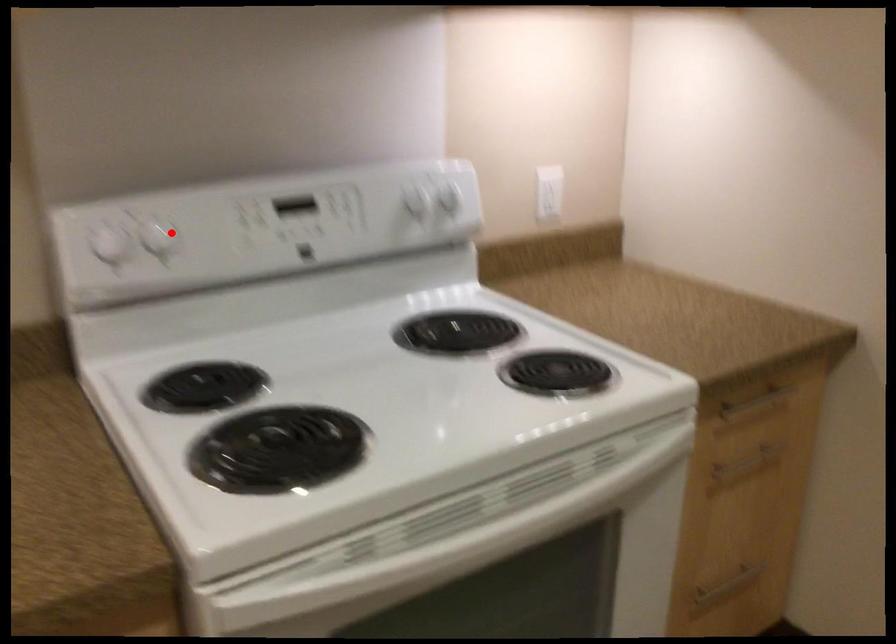
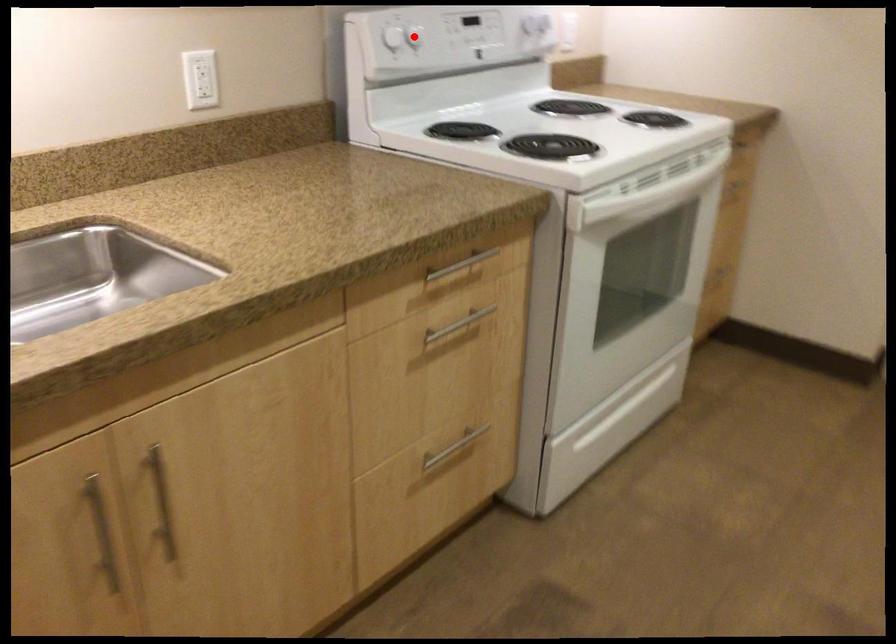
I am providing you with two images of the same scene from different viewpoints. A red point is marked on the first image and another point is marked on the second image. Does the point marked in image1 correspond to the same location as the one in image2?

Yes